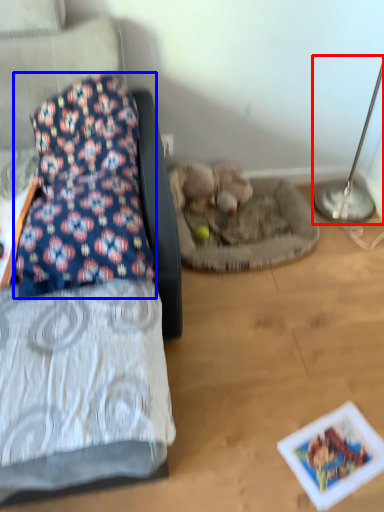
Question: Which object is further to the camera taking this photo, table lamp (highlighted by a red box) or pillow (highlighted by a blue box)?

Choices:
 (A) table lamp
 (B) pillow

Answer: (A)